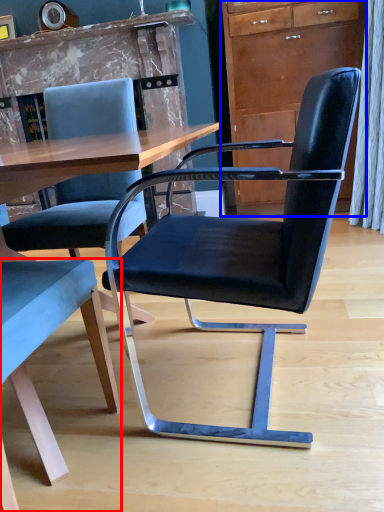
Question: Among these objects, which one is farthest to the camera, chair (highlighted by a red box) or cabinetry (highlighted by a blue box)?

Choices:
 (A) chair
 (B) cabinetry

Answer: (B)